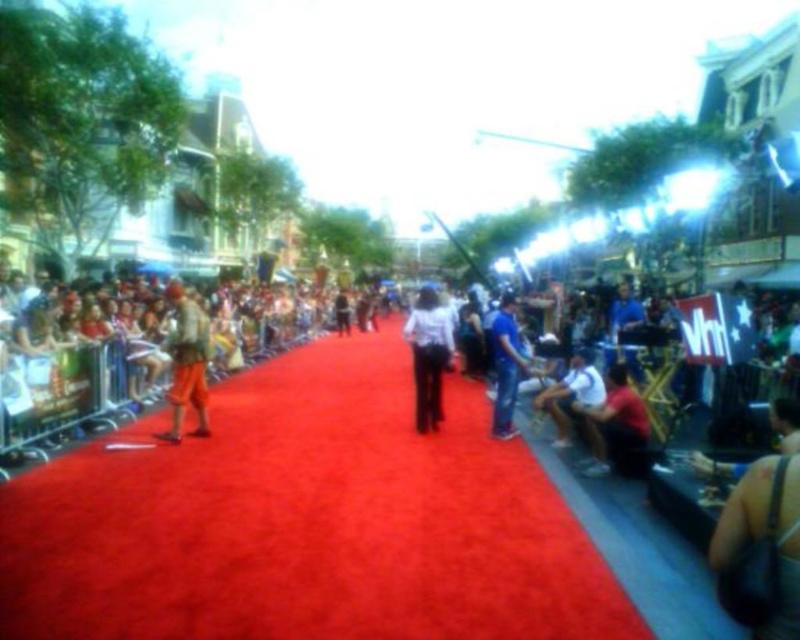
Is point (202, 417) farther from viewer compared to point (508, 392)?

No, it is in front of (508, 392).

Does orange cotton pants at left have a larger size compared to blue denim jeans at center?

No, orange cotton pants at left is not bigger than blue denim jeans at center.

This screenshot has width=800, height=640. I want to click on orange cotton pants at left, so click(x=188, y=364).

Which is below, white matte dress at center or white cotton shirt at center?

white cotton shirt at center is lower down.

The image size is (800, 640). What do you see at coordinates (428, 355) in the screenshot?
I see `white matte dress at center` at bounding box center [428, 355].

Locate an element on the screen. white matte dress at center is located at coordinates (428, 355).

Does matte white shirt at lower right have a greater width compared to blue denim jeans at center?

No, matte white shirt at lower right is not wider than blue denim jeans at center.

Which is behind, point (600, 419) or point (504, 413)?

The point (504, 413) is more distant.

Locate an element on the screen. Image resolution: width=800 pixels, height=640 pixels. matte white shirt at lower right is located at coordinates (616, 428).